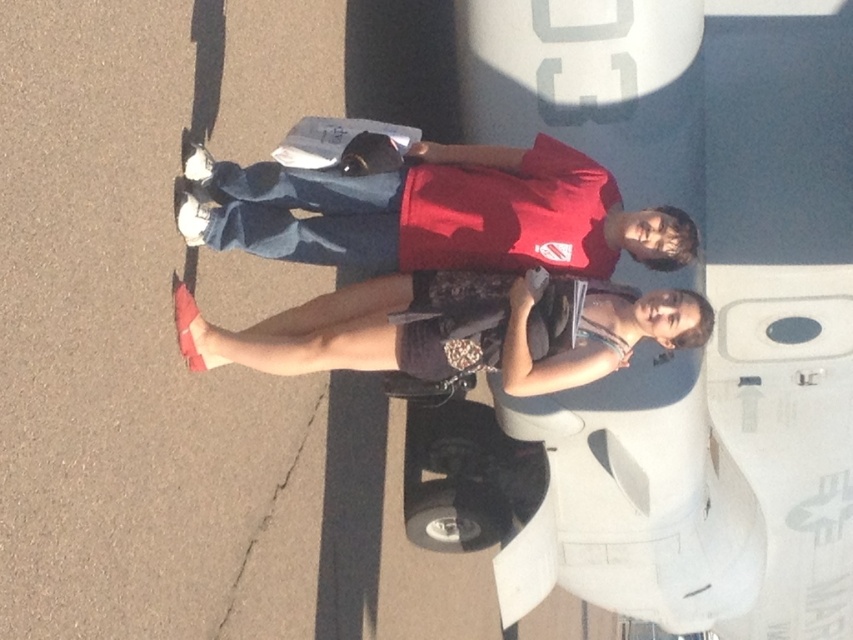
How distant is matte red t-shirt at center from leather sandals at lower left?

matte red t-shirt at center and leather sandals at lower left are 22.84 centimeters apart from each other.

Is matte red t-shirt at center positioned behind leather sandals at lower left?

Yes, matte red t-shirt at center is further from the viewer.

Where is `matte red t-shirt at center`? The image size is (853, 640). matte red t-shirt at center is located at coordinates (436, 212).